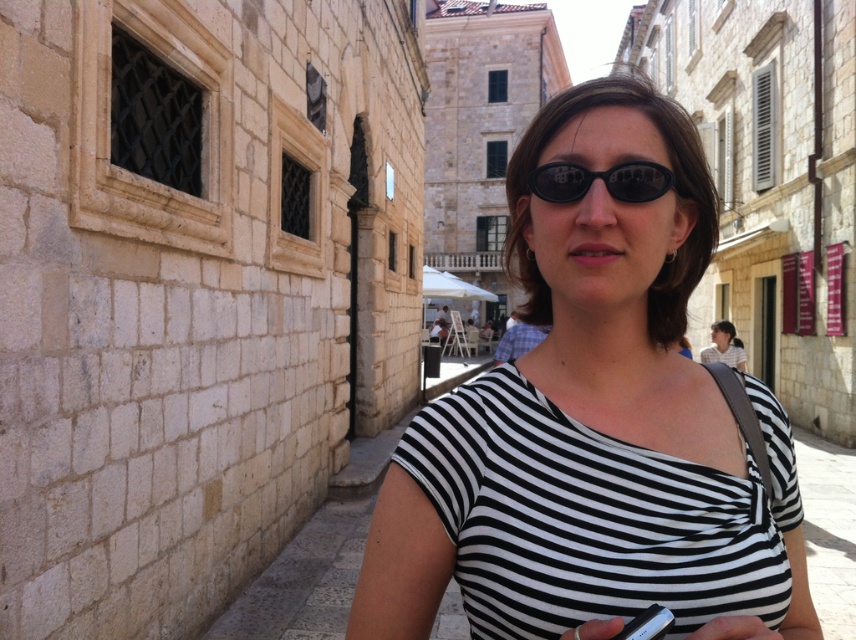
You are a photographer trying to capture the person in the alleyway. The black and white striped shirt at center and black matte sunglasses at center are both important for the shot. If you want to ensure both objects are fully visible in the frame, which object should you focus on to avoid cropping?

You should focus on the black and white striped shirt at center because it might be wider than the black matte sunglasses at center, so ensuring the wider object fits will automatically include the narrower one.

You are a photographer trying to capture the person in the narrow alley. You notice the black and white striped shirt at center and the black matte sunglasses at center. Which object is positioned closer to the camera? Please explain based on their spatial relationship.

The black and white striped shirt at center is closer to the viewer than the black matte sunglasses at center, so the shirt would appear nearer to the camera in the photo.